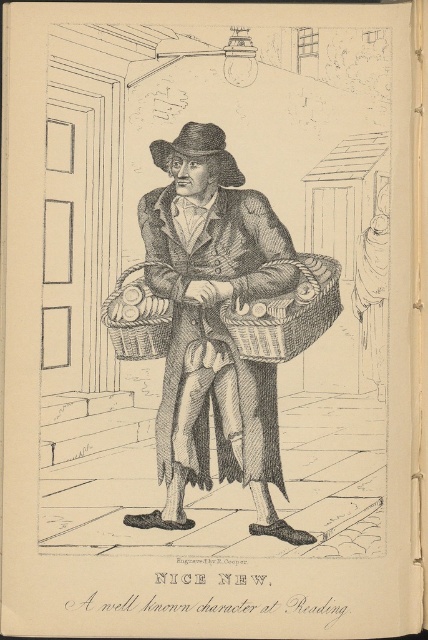
You are an art historian examining this engraving. You notice the brown wicker basket at center and the brown felt hat at center. Which object is positioned closer to the viewer?

The brown wicker basket at center is closer to the viewer than the brown felt hat at center.

You are an observer looking at the engraving. You notice the brown wicker basket at center and the brown felt hat at center. Which object is positioned lower in the image?

The brown wicker basket at center is below the brown felt hat at center, so the brown wicker basket at center is positioned lower in the image.

You are an architect analyzing this historical engraving. You need to determine the position of the brown wicker basket at center relative to the door and the shed. Based on the coordinates provided, can you determine which object is closer to the basket?

The brown wicker basket at center is located at point (213, 326). Since the coordinates are not provided for the door and shed, I cannot determine their exact positions relative to the basket. Please provide coordinates for the other objects to compare.